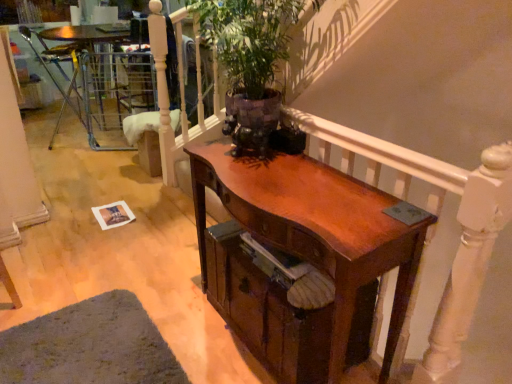
At what (x,y) coordinates should I click in order to perform the action: click on green leafy plant at upper center. Please return your answer as a coordinate pair (x, y). The height and width of the screenshot is (384, 512). Looking at the image, I should click on (249, 63).

Identify the location of shiny brown desk at center. The height and width of the screenshot is (384, 512). (316, 230).

What is the approximate height of wooden drawer at center?

It is 40.28 centimeters.

I want to click on green leafy plant at upper center, so 249,63.

The height and width of the screenshot is (384, 512). I want to click on armchair above the shiny brown desk at center (from a real-world perspective), so click(58, 70).

From the image's perspective, is metallic silver chair at left below shiny brown desk at center?

No.

Is metallic silver chair at left beside shiny brown desk at center?

metallic silver chair at left is not next to shiny brown desk at center, and they're not touching.

From a real-world perspective, is metallic silver chair at left positioned above or below wooden drawer at center?

metallic silver chair at left is above wooden drawer at center.

From the image's perspective, which one is positioned higher, metallic silver chair at left or wooden drawer at center?

metallic silver chair at left, from the image's perspective.

Is metallic silver chair at left far from wooden drawer at center?

metallic silver chair at left is far away from wooden drawer at center.

Between point (61, 67) and point (350, 347), which one is positioned in front?

Point (350, 347)

Considering the positions of objects wooden balustrade at upper center and shiny brown desk at center in the image provided, who is more to the right, wooden balustrade at upper center or shiny brown desk at center?

wooden balustrade at upper center.

Is wooden balustrade at upper center positioned far away from shiny brown desk at center?

wooden balustrade at upper center is near shiny brown desk at center, not far away.

Considering the sizes of objects wooden balustrade at upper center and shiny brown desk at center in the image provided, who is smaller, wooden balustrade at upper center or shiny brown desk at center?

With smaller size is wooden balustrade at upper center.

What's the angular difference between wooden balustrade at upper center and shiny brown desk at center's facing directions?

The facing directions of wooden balustrade at upper center and shiny brown desk at center are 1.06 degrees apart.

Can metallic silver chair at left be found inside wooden drawer at center?

No, metallic silver chair at left is not a part of wooden drawer at center.

Are wooden drawer at center and metallic silver chair at left making contact?

No, wooden drawer at center is not beside metallic silver chair at left.

Can you tell me how much wooden drawer at center and metallic silver chair at left differ in facing direction?

164 degrees.

In the scene shown: Which of these two, wooden drawer at center or metallic silver chair at left, is bigger?

Bigger between the two is metallic silver chair at left.

Locate an element on the screen. houseplant that is on the left side of wooden balustrade at upper center is located at coordinates click(249, 63).

Which object is positioned more to the left, green leafy plant at upper center or wooden balustrade at upper center?

green leafy plant at upper center is more to the left.

From a real-world perspective, is green leafy plant at upper center on top of wooden balustrade at upper center?

Correct, in the physical world, green leafy plant at upper center is higher than wooden balustrade at upper center.

Which is nearer, (239, 150) or (461, 267)?

The point (461, 267) is closer to the camera.

Does shiny brown desk at center have a larger size compared to wooden balustrade at upper center?

Correct, shiny brown desk at center is larger in size than wooden balustrade at upper center.

From the image's perspective, between shiny brown desk at center and wooden balustrade at upper center, who is located below?

shiny brown desk at center is shown below in the image.

Is shiny brown desk at center wider than wooden balustrade at upper center?

Yes, shiny brown desk at center is wider than wooden balustrade at upper center.

Is green leafy plant at upper center situated inside wooden drawer at center or outside?

green leafy plant at upper center is not inside wooden drawer at center, it's outside.

How different are the orientations of green leafy plant at upper center and wooden drawer at center in degrees?

The angular difference between green leafy plant at upper center and wooden drawer at center is 0.814 degrees.

Is green leafy plant at upper center smaller than wooden drawer at center?

Actually, green leafy plant at upper center might be larger than wooden drawer at center.

Looking at this image, considering the positions of objects green leafy plant at upper center and wooden drawer at center in the image provided, who is in front, green leafy plant at upper center or wooden drawer at center?

green leafy plant at upper center is more forward.

Locate an element on the screen. The image size is (512, 384). desk below the metallic silver chair at left (from a real-world perspective) is located at coordinates (316, 230).

You are a GUI agent. You are given a task and a screenshot of the screen. Output one action in this format:
    pyautogui.click(x=<x>, y=<y>)
    Task: Click on the drawer below the metallic silver chair at left (from the image's perspective)
    This screenshot has width=512, height=384.
    Given the screenshot: What is the action you would take?
    pyautogui.click(x=270, y=307)

Based on their spatial positions, is shiny brown desk at center or green leafy plant at upper center further from metallic silver chair at left?

shiny brown desk at center is positioned further to the anchor metallic silver chair at left.

Based on the photo, considering their positions, is wooden balustrade at upper center positioned closer to wooden drawer at center than green leafy plant at upper center?

wooden balustrade at upper center is closer to wooden drawer at center.

Looking at the image, which one is located closer to wooden balustrade at upper center, shiny brown desk at center or wooden drawer at center?

Based on the image, shiny brown desk at center appears to be nearer to wooden balustrade at upper center.

Looking at this image, looking at the image, which one is located closer to shiny brown desk at center, metallic silver chair at left or green leafy plant at upper center?

green leafy plant at upper center.

When comparing their distances from green leafy plant at upper center, does shiny brown desk at center or metallic silver chair at left seem closer?

Among the two, shiny brown desk at center is located nearer to green leafy plant at upper center.

Based on their spatial positions, is metallic silver chair at left or green leafy plant at upper center further from wooden balustrade at upper center?

metallic silver chair at left is further to wooden balustrade at upper center.

Consider the image. Considering their positions, is green leafy plant at upper center positioned further to metallic silver chair at left than wooden drawer at center?

Among the two, wooden drawer at center is located further to metallic silver chair at left.

Looking at the image, which one is located closer to metallic silver chair at left, wooden balustrade at upper center or wooden drawer at center?

wooden drawer at center is closer to metallic silver chair at left.

At what (x,y) coordinates should I click in order to perform the action: click on houseplant between shiny brown desk at center and metallic silver chair at left along the z-axis. Please return your answer as a coordinate pair (x, y). The height and width of the screenshot is (384, 512). Looking at the image, I should click on (249, 63).

You are a GUI agent. You are given a task and a screenshot of the screen. Output one action in this format:
    pyautogui.click(x=<x>, y=<y>)
    Task: Click on the drawer between wooden balustrade at upper center and metallic silver chair at left in the front-back direction
    
    Given the screenshot: What is the action you would take?
    pyautogui.click(x=270, y=307)

Locate an element on the screen. The height and width of the screenshot is (384, 512). balustrade that lies between green leafy plant at upper center and shiny brown desk at center from top to bottom is located at coordinates (436, 215).

You are a GUI agent. You are given a task and a screenshot of the screen. Output one action in this format:
    pyautogui.click(x=<x>, y=<y>)
    Task: Click on the desk between green leafy plant at upper center and wooden drawer at center in the up-down direction
    The height and width of the screenshot is (384, 512).
    Given the screenshot: What is the action you would take?
    pyautogui.click(x=316, y=230)